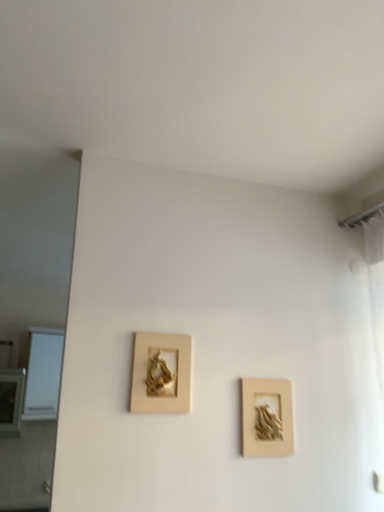
Question: Which is correct: matte gold picture frame at center, arranged as the 2th picture frame when viewed from the right, is inside white glass window at left, or outside of it?

Choices:
 (A) outside
 (B) inside

Answer: (A)

Question: Looking at their shapes, would you say matte gold picture frame at center, acting as the first picture frame starting from the left, is wider or thinner than white glass window at left?

Choices:
 (A) thin
 (B) wide

Answer: (A)

Question: Considering the real-world distances, which object is farthest from the beige matte picture frame at center-right, which is the 2th picture frame in left-to-right order?

Choices:
 (A) matte gold picture frame at center, arranged as the 2th picture frame when viewed from the right
 (B) white glass window at left

Answer: (B)

Question: Considering the real-world distances, which object is farthest from the white glass window at left?

Choices:
 (A) beige matte picture frame at center-right, which is the 2th picture frame in left-to-right order
 (B) matte gold picture frame at center, arranged as the 2th picture frame when viewed from the right

Answer: (A)